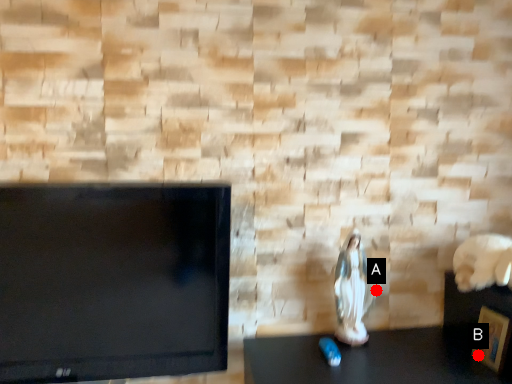
Question: Two points are circled on the image, labeled by A and B beside each circle. Which point appears closest to the camera in this image?

Choices:
 (A) A is closer
 (B) B is closer

Answer: (B)